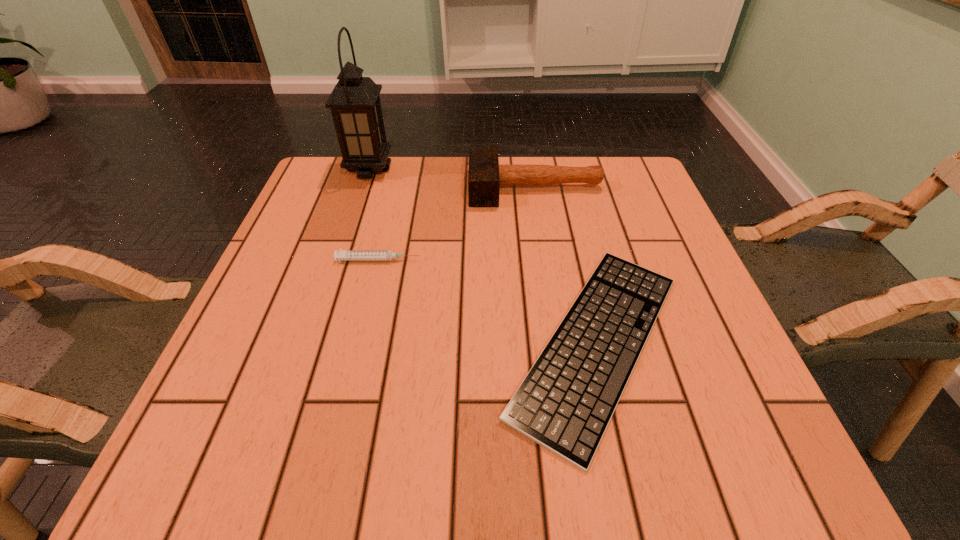
This screenshot has height=540, width=960. Find the location of `vacant space that's between the tallest object and the syringe`. vacant space that's between the tallest object and the syringe is located at coordinates (373, 214).

Locate an element on the screen. The width and height of the screenshot is (960, 540). unoccupied position between the tallest object and the third shortest object is located at coordinates (452, 178).

Where is `vacant area that lies between the lantern and the computer keyboard`? This screenshot has height=540, width=960. vacant area that lies between the lantern and the computer keyboard is located at coordinates (483, 256).

This screenshot has height=540, width=960. Find the location of `free area in between the tallest object and the second tallest object`. free area in between the tallest object and the second tallest object is located at coordinates click(452, 178).

Identify the location of blank region between the third tallest object and the mallet. (457, 224).

Find the location of a particular element. The image size is (960, 540). vacant region between the computer keyboard and the second tallest object is located at coordinates (566, 265).

The width and height of the screenshot is (960, 540). Identify the location of free space that is in between the computer keyboard and the syringe. (488, 301).

In order to click on the closest object to the second shortest object in this screenshot , I will do `click(565, 403)`.

You are a GUI agent. You are given a task and a screenshot of the screen. Output one action in this format:
    pyautogui.click(x=<x>, y=<y>)
    Task: Click on the object that stands as the third closest to the shortest object
    The width and height of the screenshot is (960, 540).
    Given the screenshot: What is the action you would take?
    pyautogui.click(x=355, y=105)

Where is `vacant space that satisfies the following two spatial constraints: 1. on the front side of the shortest object; 2. on the left side of the tallest object`? vacant space that satisfies the following two spatial constraints: 1. on the front side of the shortest object; 2. on the left side of the tallest object is located at coordinates (311, 343).